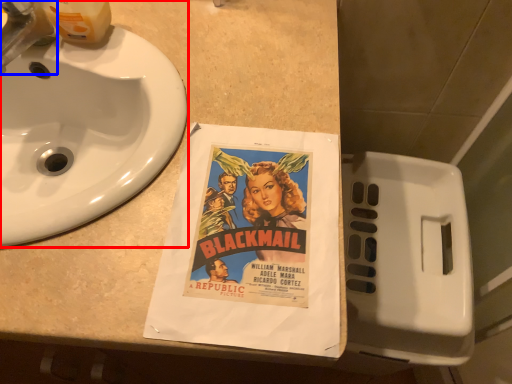
Question: Which object appears farthest to the camera in this image, sink (highlighted by a red box) or faucet (highlighted by a blue box)?

Choices:
 (A) sink
 (B) faucet

Answer: (B)